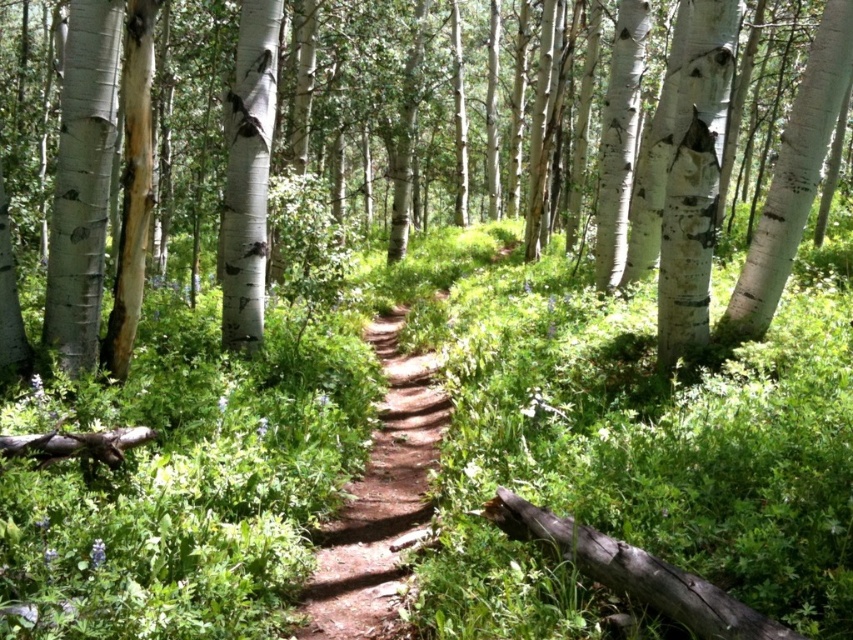
Question: Can you confirm if brown dirt path at center is thinner than white smooth tree trunk at center?

Choices:
 (A) no
 (B) yes

Answer: (B)

Question: Can you confirm if white smooth tree at center is smaller than brown dirt path at center?

Choices:
 (A) no
 (B) yes

Answer: (A)

Question: Which object is the farthest from the brown dirt path at center?

Choices:
 (A) white smooth tree trunk at center
 (B) white smooth tree at center

Answer: (B)

Question: Which point appears closest to the camera in this image?

Choices:
 (A) (96, 58)
 (B) (248, 339)
 (C) (358, 584)

Answer: (C)

Question: Which point is closer to the camera?

Choices:
 (A) (401, 99)
 (B) (347, 506)

Answer: (B)

Question: Is brown dirt path at center positioned at the back of white smooth tree trunk at center?

Choices:
 (A) yes
 (B) no

Answer: (A)